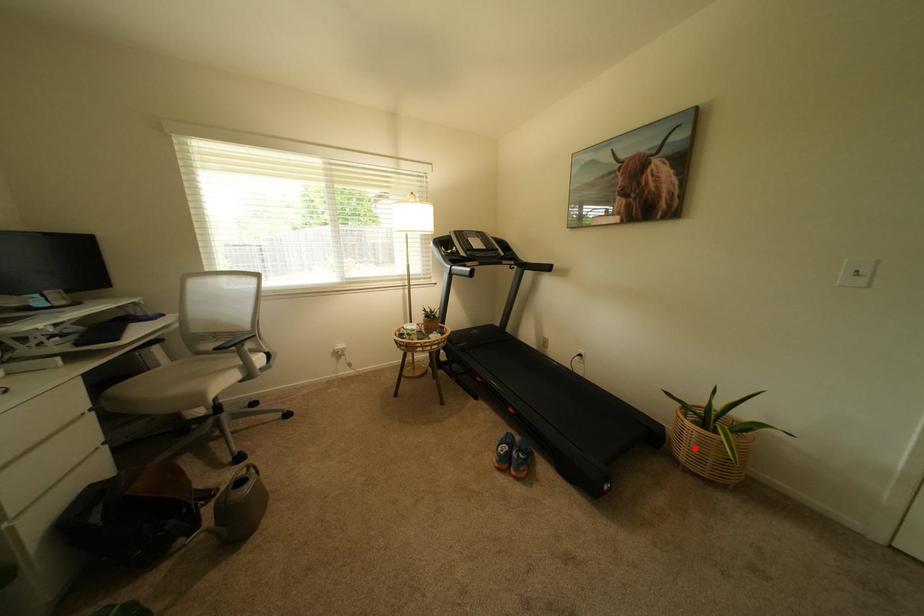
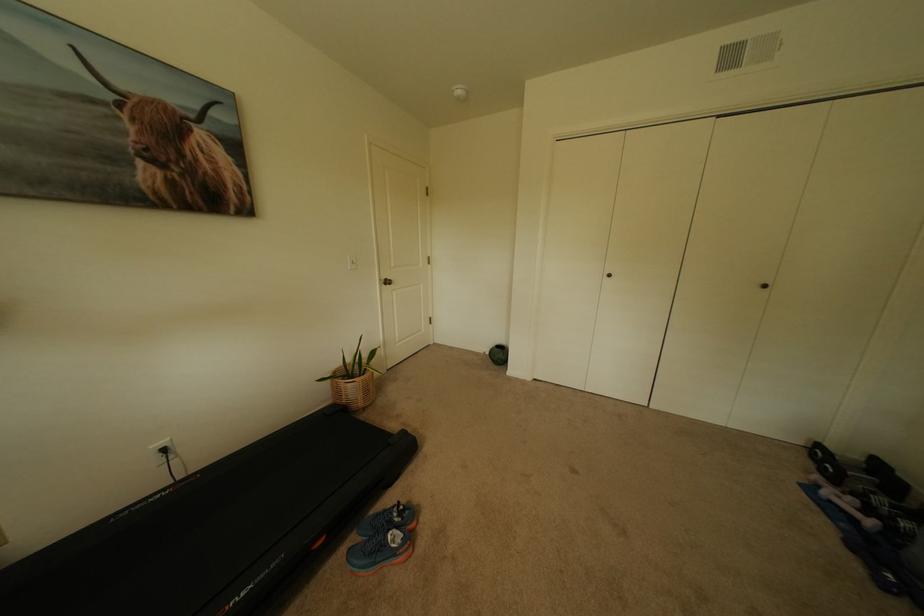
The point at the highlighted location is marked in the first image. Where is the corresponding point in the second image?

(370, 395)